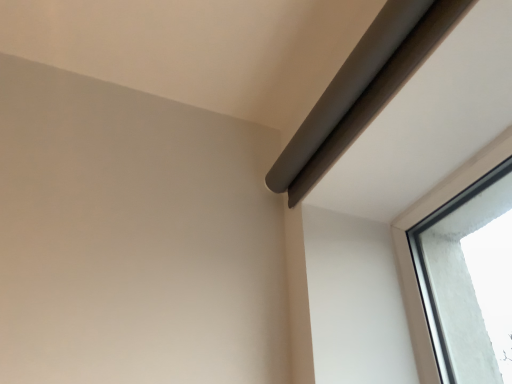
The image size is (512, 384). What are the coordinates of `matte gray curtain at upper right` in the screenshot? It's located at (362, 89).

Describe the element at coordinates (362, 89) in the screenshot. This screenshot has width=512, height=384. I see `matte gray curtain at upper right` at that location.

Image resolution: width=512 pixels, height=384 pixels. I want to click on matte gray curtain at upper right, so click(x=362, y=89).